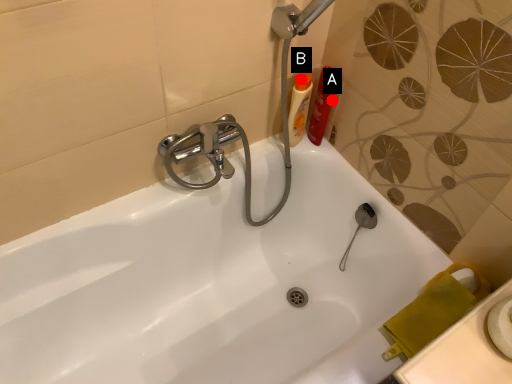
Question: Two points are circled on the image, labeled by A and B beside each circle. Which of the following is the closest to the observer?

Choices:
 (A) A is closer
 (B) B is closer

Answer: (B)